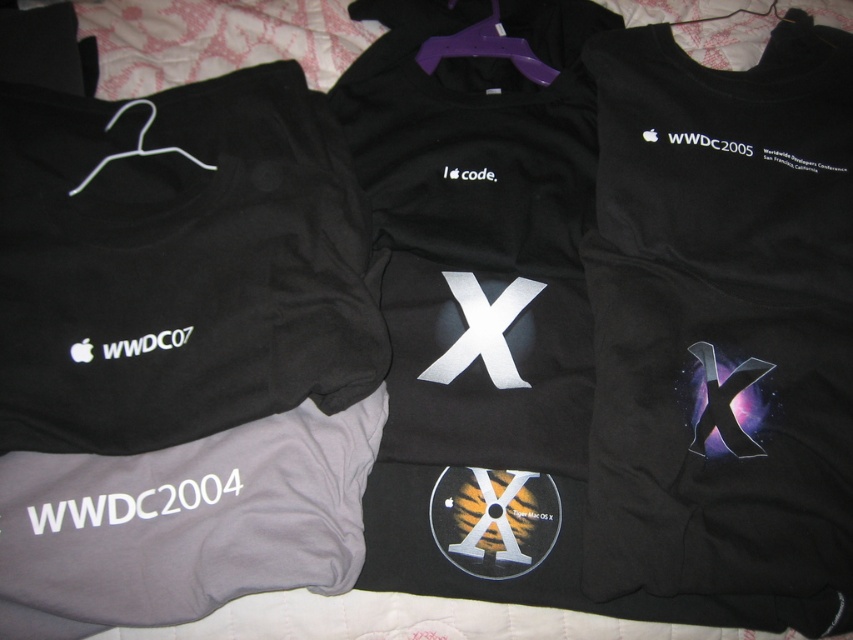
Between black matte sweatshirt at center and gray cotton t-shirt at lower left, which one appears on the left side from the viewer's perspective?

From the viewer's perspective, gray cotton t-shirt at lower left appears more on the left side.

Who is more forward, (804, 346) or (224, 500)?

Positioned in front is point (224, 500).

The image size is (853, 640). I want to click on black matte sweatshirt at center, so click(722, 320).

Does black matte sweatshirt at center have a larger size compared to black matte t-shirt at center?

Indeed, black matte sweatshirt at center has a larger size compared to black matte t-shirt at center.

Who is more forward, [634,186] or [485,429]?

Point [485,429] is more forward.

Where is `black matte sweatshirt at center`? The height and width of the screenshot is (640, 853). black matte sweatshirt at center is located at coordinates (722, 320).

Between point (563, 38) and point (334, 460), which one is positioned in front?

Point (334, 460) is in front.

Between point (575, 384) and point (171, 561), which one is positioned behind?

Positioned behind is point (575, 384).

I want to click on black matte t-shirt at center, so click(x=477, y=285).